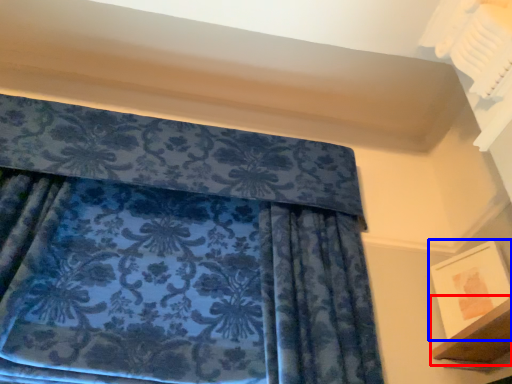
Question: Which point is further to the camera, shelf (highlighted by a red box) or picture frame (highlighted by a blue box)?

Choices:
 (A) shelf
 (B) picture frame

Answer: (B)